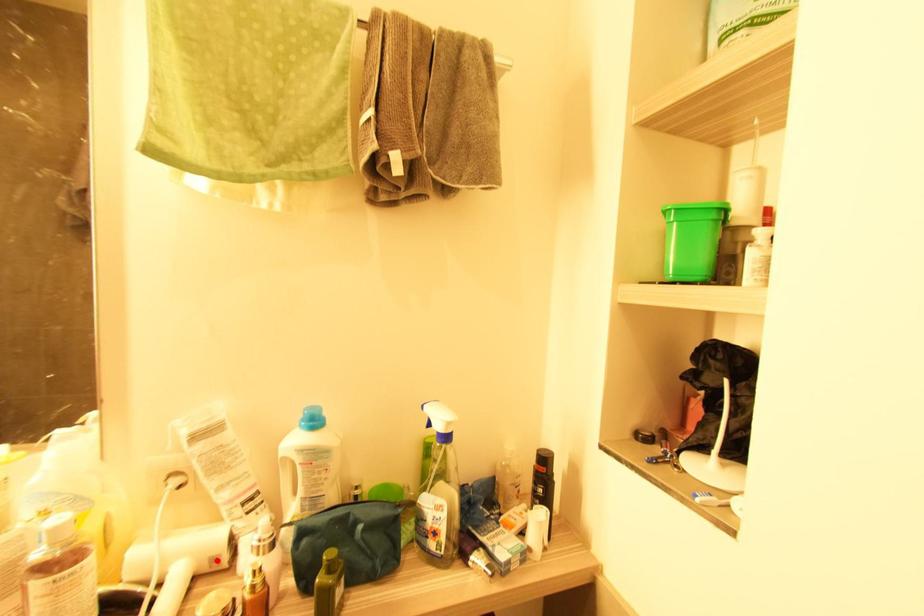
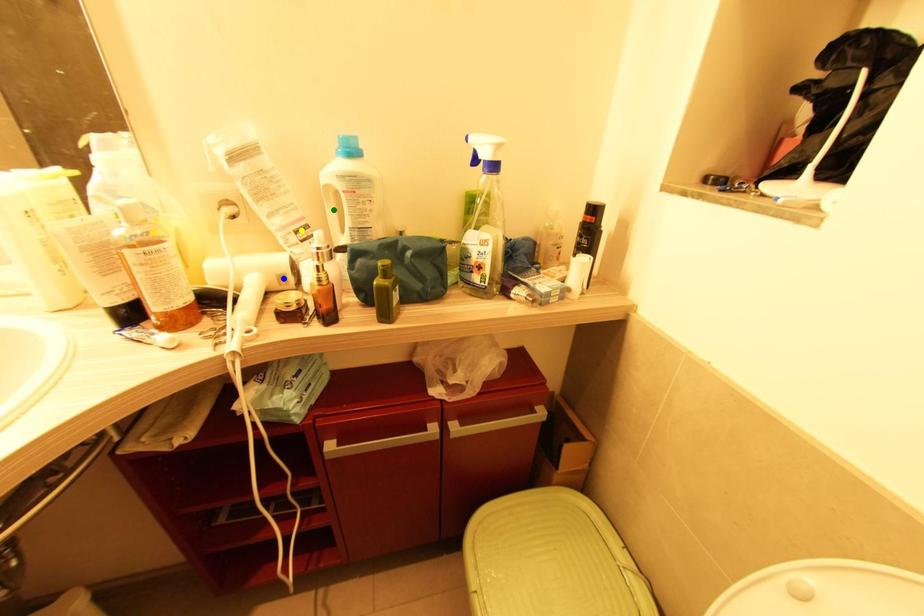
Question: I am providing you with two images of the same scene from different viewpoints. A red point is marked on the first image. You are given multiple points on the second image. In image 2, which mark is for the same physical point as the one in image 1?

Choices:
 (A) green point
 (B) yellow point
 (C) blue point

Answer: (C)